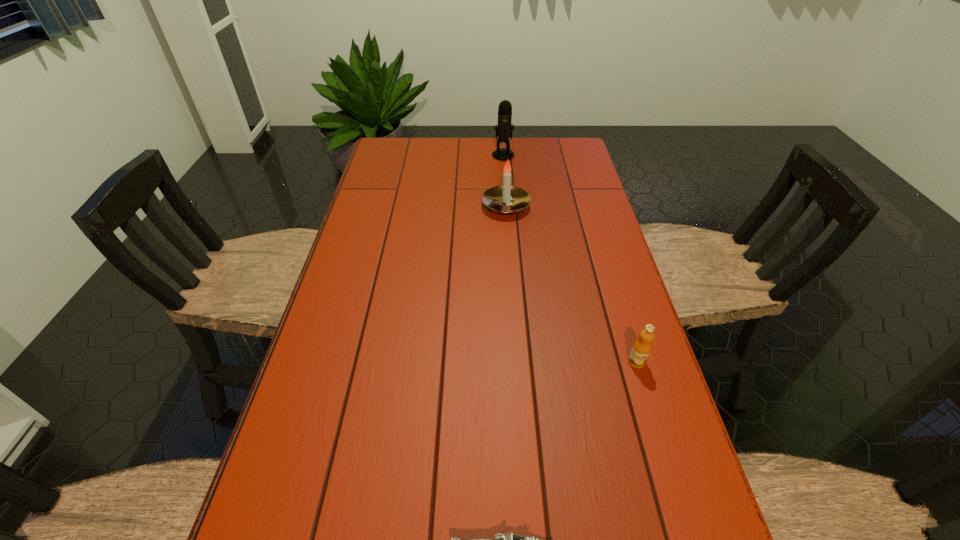
Identify the location of object located in the right edge section of the desktop. Image resolution: width=960 pixels, height=540 pixels. (642, 347).

Identify the location of free space at the far edge of the desktop. The image size is (960, 540). (523, 169).

Identify the location of vacant space at the left edge of the desktop. (373, 255).

This screenshot has width=960, height=540. I want to click on vacant area at the right edge, so click(604, 219).

You are a GUI agent. You are given a task and a screenshot of the screen. Output one action in this format:
    pyautogui.click(x=<x>, y=<y>)
    Task: Click on the free space at the far left corner of the desktop
    This screenshot has height=540, width=960.
    Given the screenshot: What is the action you would take?
    pyautogui.click(x=420, y=153)

The image size is (960, 540). What are the coordinates of `free space at the far right corner of the desktop` in the screenshot? It's located at (550, 139).

Image resolution: width=960 pixels, height=540 pixels. I want to click on free space between the rightmost object and the second farthest object, so click(x=571, y=284).

Locate an element on the screen. This screenshot has width=960, height=540. empty space that is in between the third farthest object and the second farthest object is located at coordinates (571, 284).

Where is `vacant space that is in between the rightmost object and the microphone`? The width and height of the screenshot is (960, 540). vacant space that is in between the rightmost object and the microphone is located at coordinates (570, 258).

Image resolution: width=960 pixels, height=540 pixels. What are the coordinates of `object that is the second closest to the tallest object` in the screenshot? It's located at (642, 347).